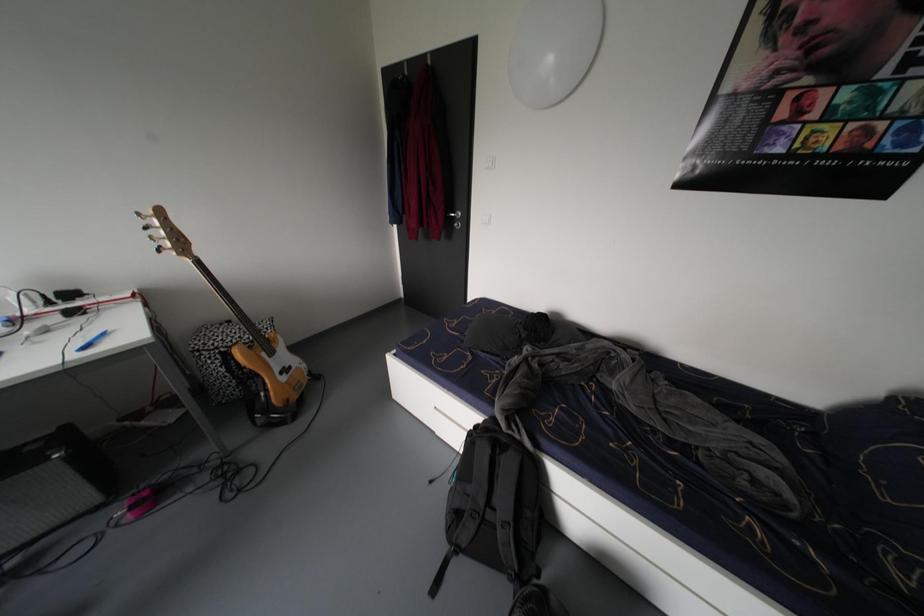
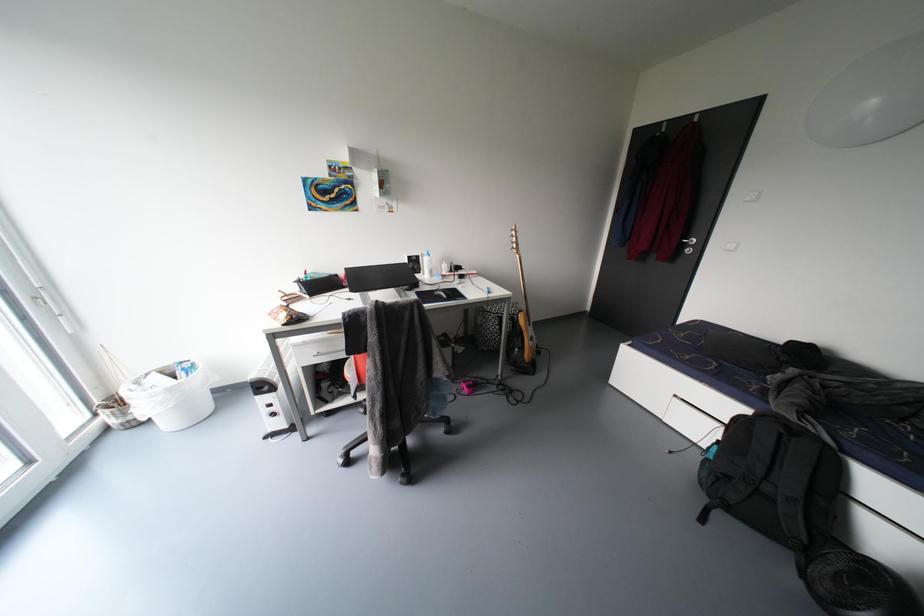
The images are taken continuously from a first-person perspective. In which direction are you moving?

The movement direction of the cameraman is left, backward.